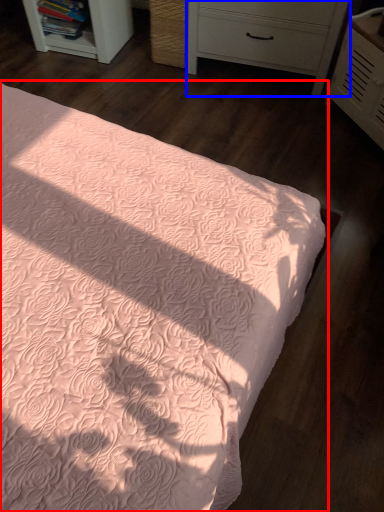
Question: Which object appears farthest to the camera in this image, bed (highlighted by a red box) or chest of drawers (highlighted by a blue box)?

Choices:
 (A) bed
 (B) chest of drawers

Answer: (B)